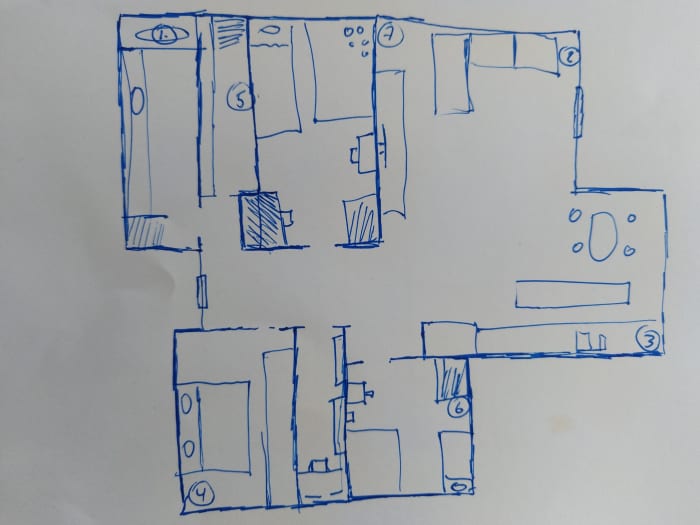
Locate an element on the screen. bottom chair to the right is located at coordinates (626, 248).